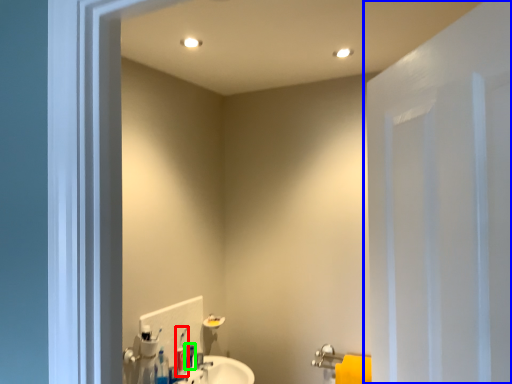
Question: Based on their relative distances, which object is farther from toothbrush (highlighted by a red box)? Choose from door (highlighted by a blue box) and toiletry (highlighted by a green box).

Choices:
 (A) door
 (B) toiletry

Answer: (A)